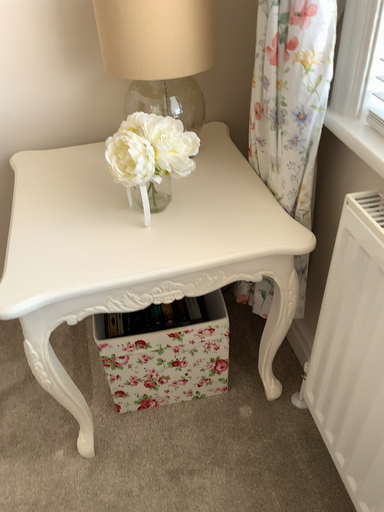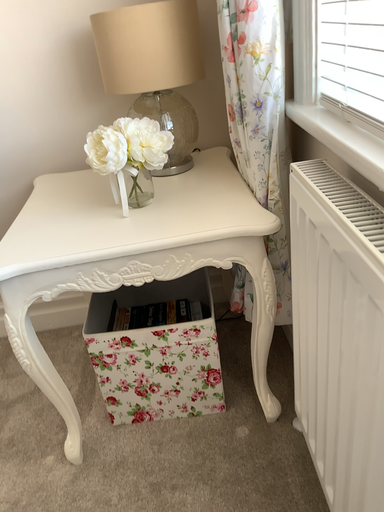
Question: Which way did the camera rotate in the video?

Choices:
 (A) rotated downward
 (B) rotated upward

Answer: (B)